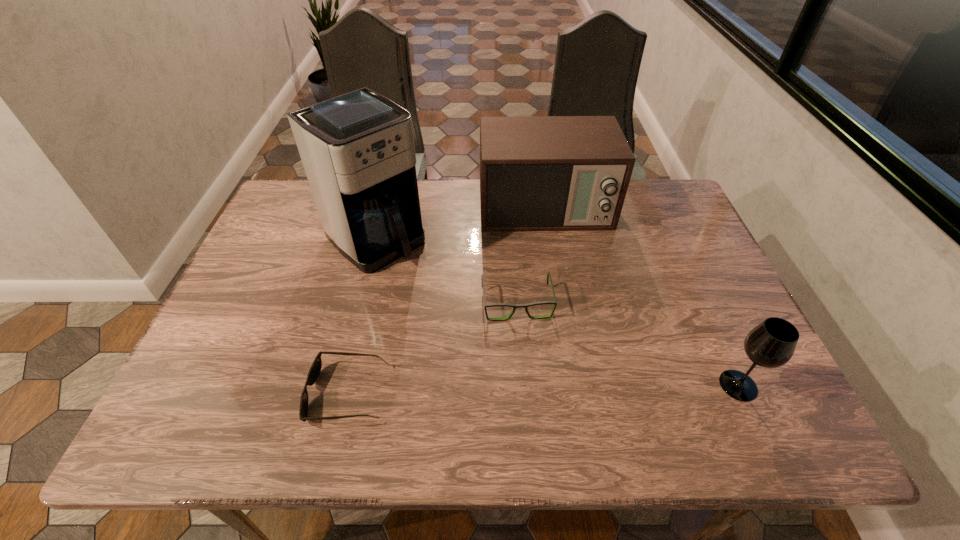
In the image, there is a desktop. Identify the location of free space at the far left corner. (293, 220).

The width and height of the screenshot is (960, 540). I want to click on vacant space at the far right corner of the desktop, so click(x=653, y=211).

Find the location of `vacant area between the fourth tallest object and the radio receiver`. vacant area between the fourth tallest object and the radio receiver is located at coordinates (531, 255).

Where is `vacant region between the spectacles and the shortest object`? The height and width of the screenshot is (540, 960). vacant region between the spectacles and the shortest object is located at coordinates (432, 348).

The image size is (960, 540). I want to click on vacant region between the coffee maker and the sunglasses, so 362,316.

Locate an element on the screen. The height and width of the screenshot is (540, 960). unoccupied area between the third farthest object and the coffee maker is located at coordinates (446, 271).

At what (x,y) coordinates should I click in order to perform the action: click on free spot between the radio receiver and the spectacles. Please return your answer as a coordinate pair (x, y). Looking at the image, I should click on (531, 255).

Where is `free space between the fourth tallest object and the coffee maker`? This screenshot has width=960, height=540. free space between the fourth tallest object and the coffee maker is located at coordinates (446, 271).

This screenshot has height=540, width=960. Find the location of `free spot between the spectacles and the coffee maker`. free spot between the spectacles and the coffee maker is located at coordinates (446, 271).

Find the location of a particular element. free space between the third shortest object and the shortest object is located at coordinates click(543, 390).